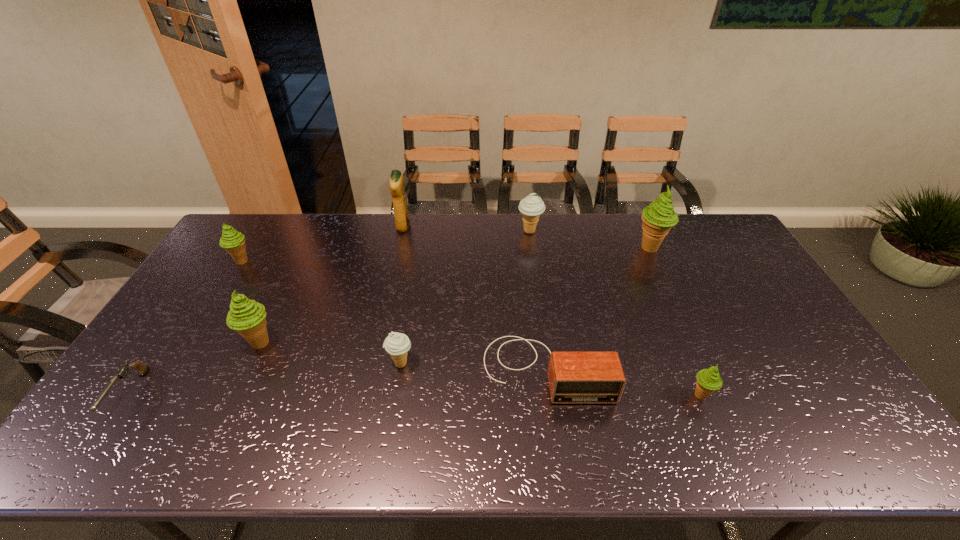
At what (x,y) coordinates should I click in order to perform the action: click on vacant space in between the leftmost object and the second nearest green icecream. Please return your answer as a coordinate pair (x, y). Looking at the image, I should click on (194, 369).

The height and width of the screenshot is (540, 960). In order to click on empty space between the second icecream from left to right and the third icecream from right to left in this screenshot , I will do `click(395, 287)`.

At what (x,y) coordinates should I click in order to perform the action: click on empty space between the leftmost object and the second smallest green icecream. Please return your answer as a coordinate pair (x, y). The height and width of the screenshot is (540, 960). Looking at the image, I should click on [x=185, y=328].

Image resolution: width=960 pixels, height=540 pixels. Find the location of `free space between the third smallest green icecream and the fourth icecream from left to right`. free space between the third smallest green icecream and the fourth icecream from left to right is located at coordinates (395, 287).

Locate an element on the screen. This screenshot has width=960, height=540. vacant area that lies between the nearest icecream and the gun is located at coordinates pyautogui.click(x=415, y=395).

At what (x,y) coordinates should I click in order to perform the action: click on free space that is in between the biggest green icecream and the leftmost green icecream. Please return your answer as a coordinate pair (x, y). The width and height of the screenshot is (960, 540). Looking at the image, I should click on (445, 255).

Find the location of a particular element. The width and height of the screenshot is (960, 540). free space that is in between the fifth object from left to right and the third farthest green icecream is located at coordinates (330, 353).

Locate an element on the screen. The image size is (960, 540). vacant region between the leftmost green icecream and the nearer beige icecream is located at coordinates (321, 313).

Where is `object that stands as the third closest to the shortest object`? object that stands as the third closest to the shortest object is located at coordinates (396, 344).

Where is `the closest object to the third farthest green icecream`? The width and height of the screenshot is (960, 540). the closest object to the third farthest green icecream is located at coordinates (141, 368).